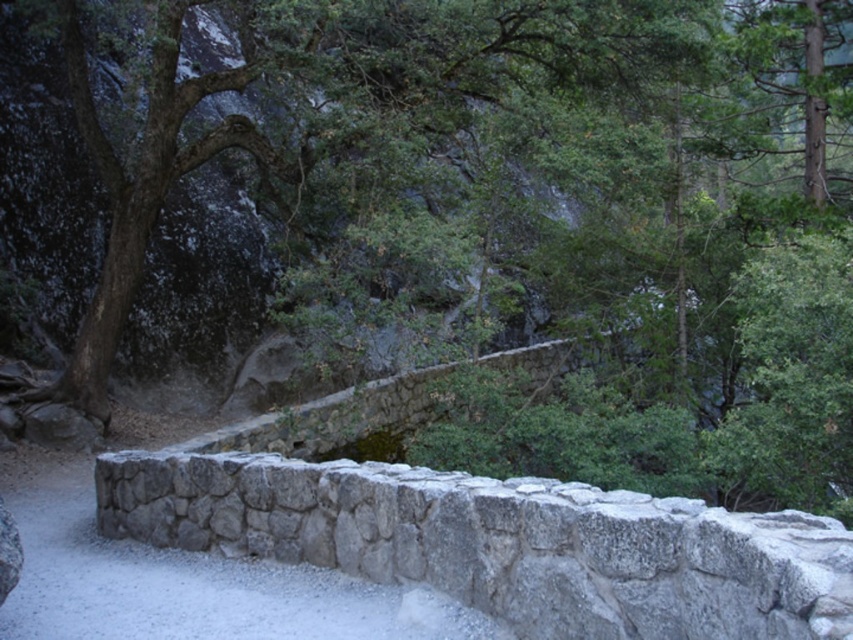
Question: Is gray stone wall at lower center to the left of gray stone wall at center from the viewer's perspective?

Choices:
 (A) no
 (B) yes

Answer: (A)

Question: Among these points, which one is nearest to the camera?

Choices:
 (A) (801, 566)
 (B) (311, 580)

Answer: (A)

Question: Does gray stone wall at lower center appear under gray stone wall at center?

Choices:
 (A) no
 (B) yes

Answer: (A)

Question: Among these objects, which one is nearest to the camera?

Choices:
 (A) gray stone wall at lower center
 (B) gray stone wall at center

Answer: (A)

Question: Is gray stone wall at lower center positioned in front of gray stone wall at center?

Choices:
 (A) no
 (B) yes

Answer: (B)